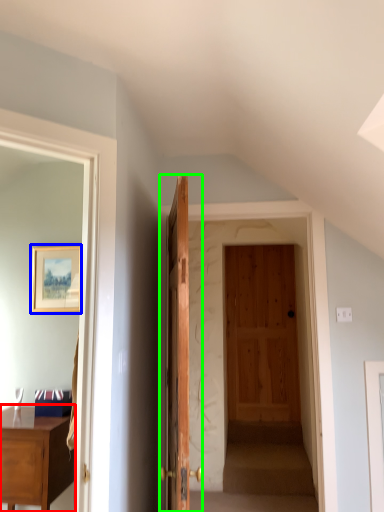
Question: Which object is the closest to the desk (highlighted by a red box)? Choose among these: picture frame (highlighted by a blue box) or door (highlighted by a green box).

Choices:
 (A) picture frame
 (B) door

Answer: (B)